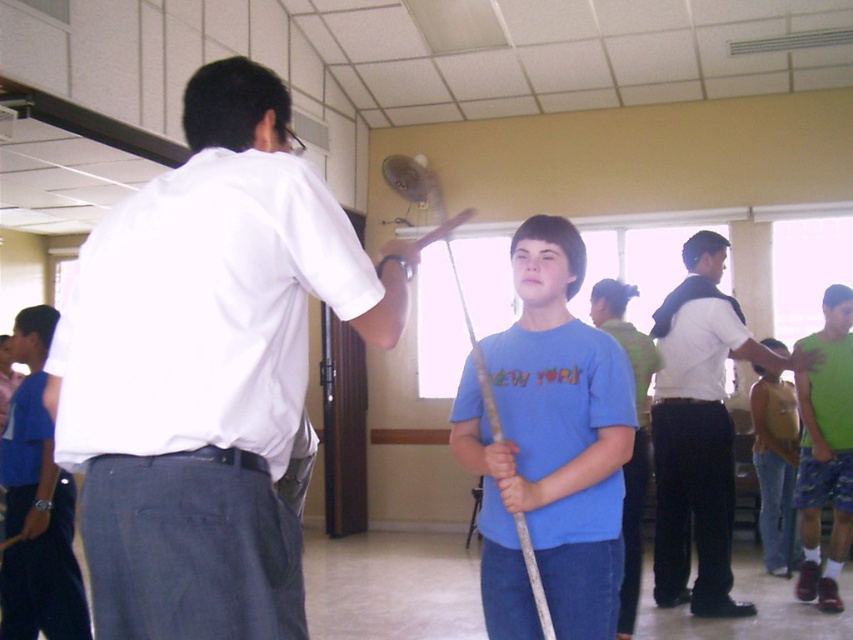
You are a photographer setting up equipment in the classroom. You need to position a large camera tripod that requires 1.2 square meters of space. Looking at the scene, can the area near the white shirt at right and the brown leather backpack at center accommodate the tripod without overlapping either object?

The white shirt at right is bigger than the brown leather backpack at center. Since the white shirt is larger, it likely occupies more space. However, the total available space near both objects needs to be at least 1.2 square meters. Without exact dimensions, it is uncertain if the combined area suffices. Consider measuring the space before placing the tripod.

Based on the photo, you are standing in the classroom and need to locate the white shirt at right. According to the coordinates provided, where should you look to find it?

The white shirt at right is located at point coordinates of (x=699, y=429).